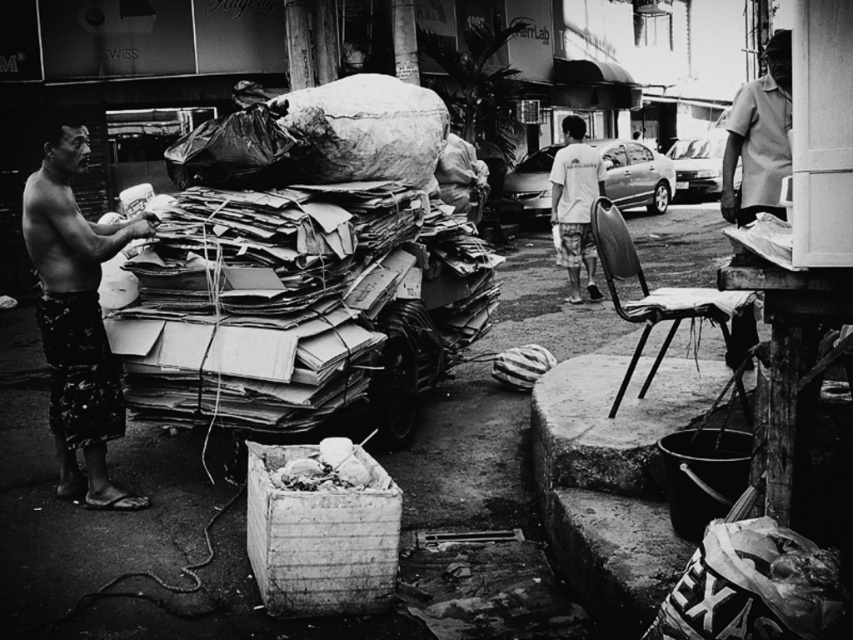
This screenshot has height=640, width=853. Identify the location of smooth gray shirt at upper right. (759, 138).

Does patterned fabric shorts at left have a lesser height compared to smooth gray shirt at upper right?

Yes, patterned fabric shorts at left is shorter than smooth gray shirt at upper right.

Is patterned fabric shorts at left wider than smooth gray shirt at upper right?

No.

Locate an element on the screen. patterned fabric shorts at left is located at coordinates (76, 317).

Is patterned fabric shorts at left behind white cotton shirt at center?

No, it is not.

Does patterned fabric shorts at left appear on the left side of white cotton shirt at center?

Indeed, patterned fabric shorts at left is positioned on the left side of white cotton shirt at center.

Which is behind, point (49, 332) or point (582, 230)?

Point (582, 230)

Image resolution: width=853 pixels, height=640 pixels. Find the location of `patterned fabric shorts at left`. patterned fabric shorts at left is located at coordinates (76, 317).